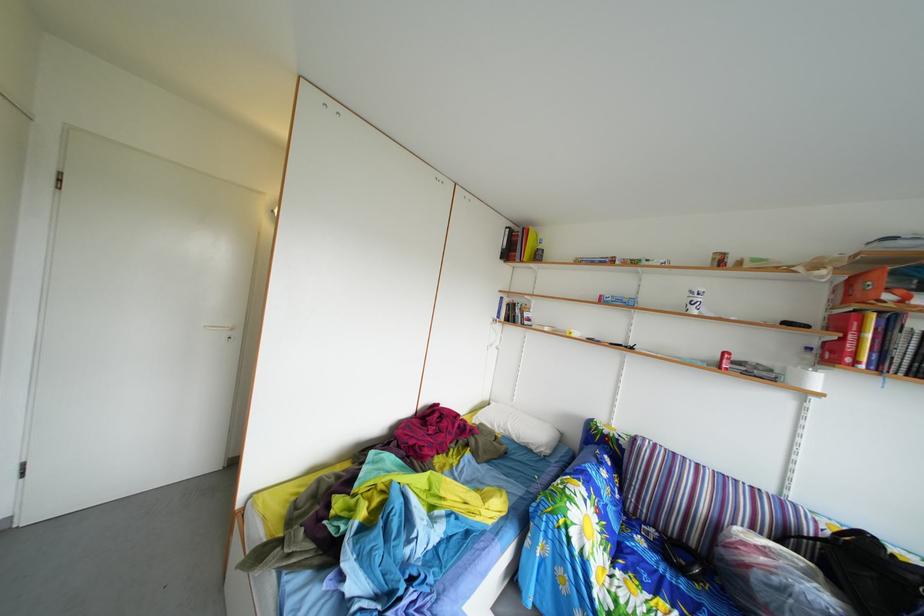
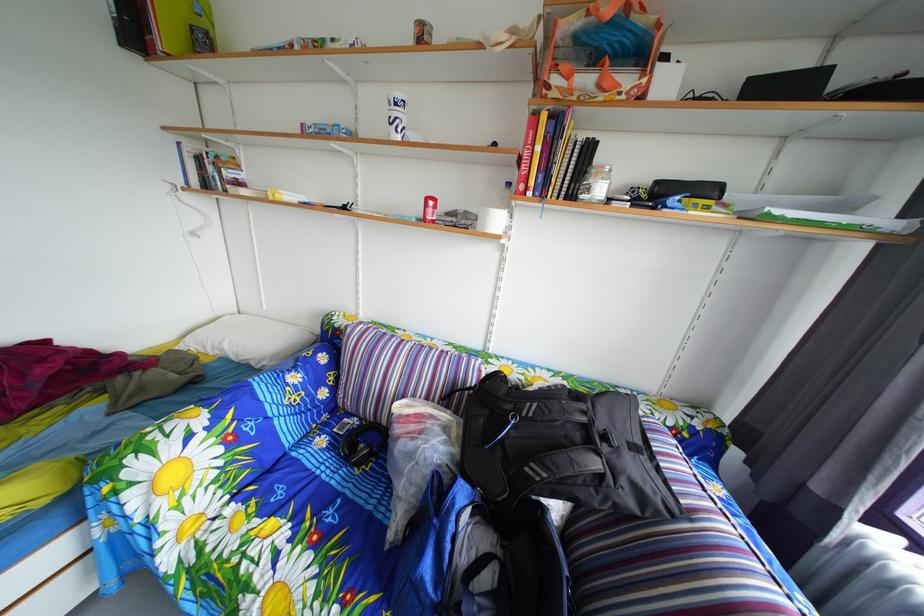
Where in the second image is the point corresponding to (509,436) from the first image?

(224, 357)